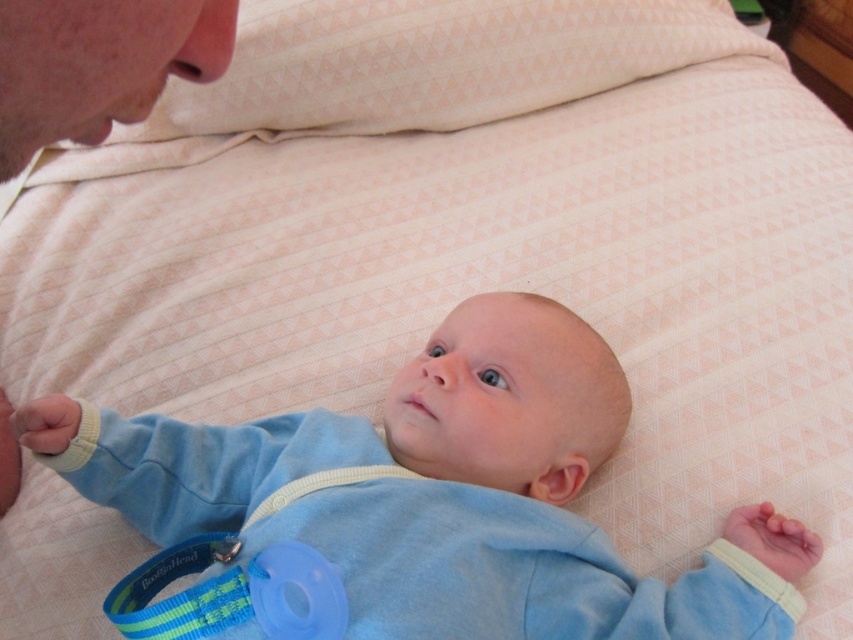
You are a photographer trying to capture the baby in the light blue onesie with a white zipper and yellow trim at the cuffs. The baby is lying on a bed, and there is a pacifier attached to a blue and green strap hanging from the baby. You want to ensure the camera is positioned exactly 80 centimeters away from the baby to get the perfect shot. Based on the scene, is the point at coordinates point [476,477] the correct spot to place the camera?

The point at coordinates point [476,477] is 79.86 centimeters from the camera, which is very close to the desired 80 centimeters. Therefore, this point is suitable for placing the camera to capture the baby at the correct distance.